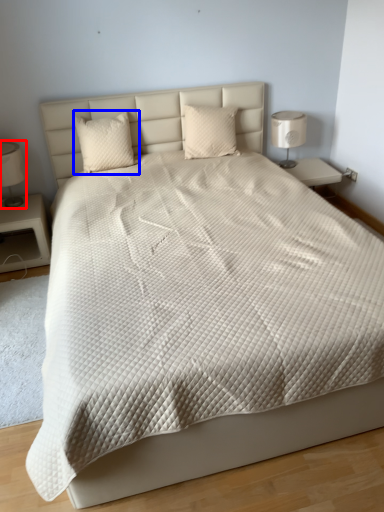
Question: Which object appears farthest to the camera in this image, bedside lamp (highlighted by a red box) or pillow (highlighted by a blue box)?

Choices:
 (A) bedside lamp
 (B) pillow

Answer: (B)